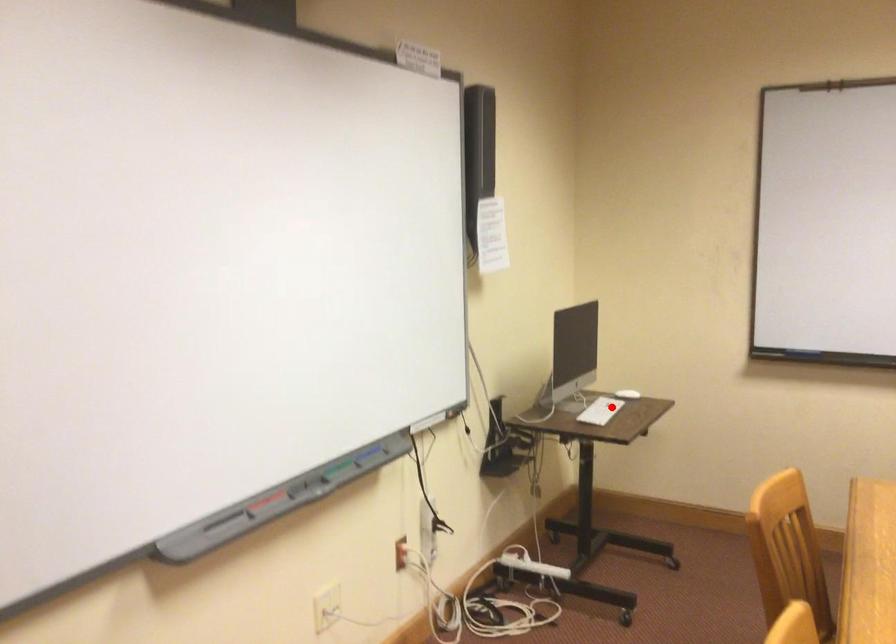
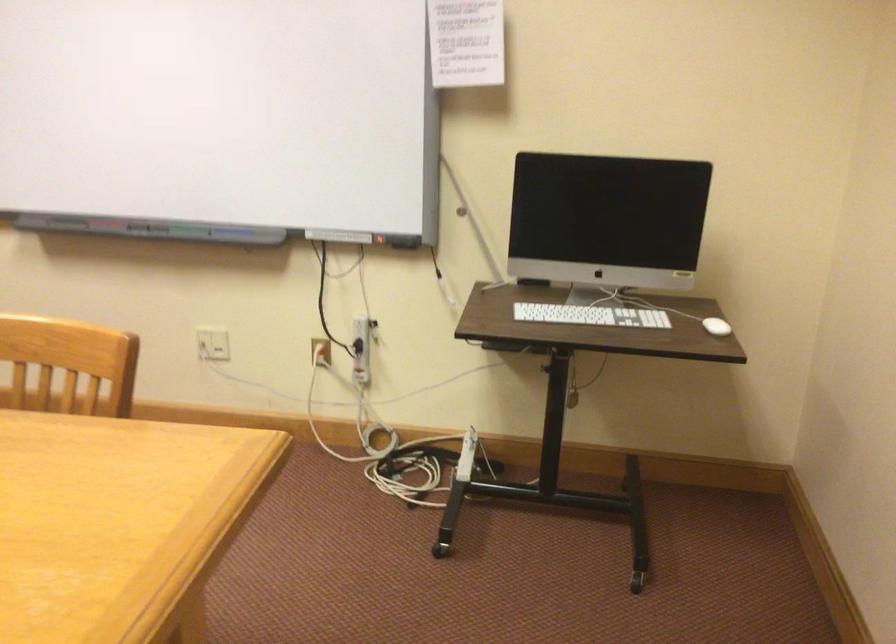
Find the pixel in the second image that matches the highlighted location in the first image.

(590, 315)